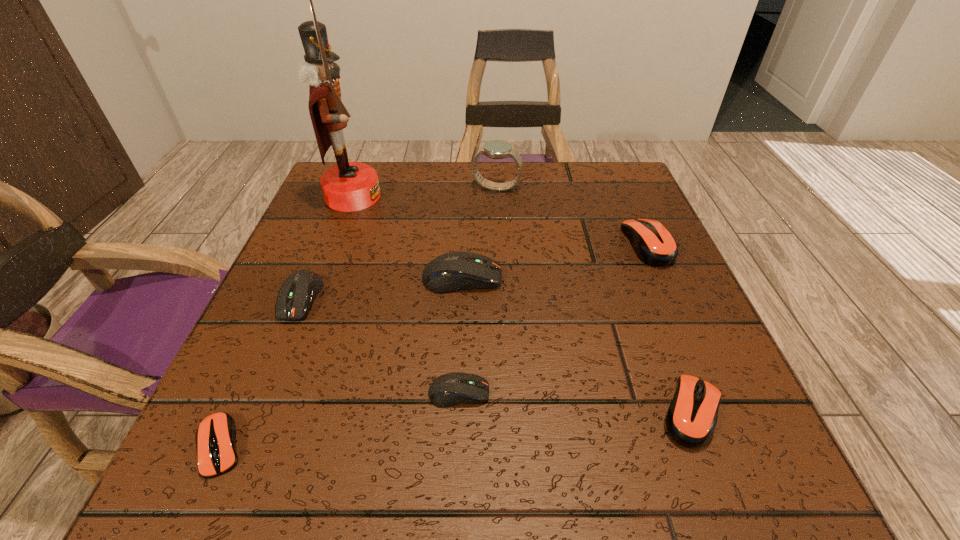
I want to click on red nutcracker, so click(347, 186).

Locate an element on the screen. nutcracker is located at coordinates (347, 186).

You are a GUI agent. You are given a task and a screenshot of the screen. Output one action in this format:
    pyautogui.click(x=<x>, y=<y>)
    Task: Click on the watch
    
    Given the screenshot: What is the action you would take?
    click(x=496, y=149)

The image size is (960, 540). Find the location of `the second tallest object`. the second tallest object is located at coordinates (496, 149).

The height and width of the screenshot is (540, 960). What are the coordinates of `the tallest computer mouse` in the screenshot? It's located at (454, 271).

Where is `the biggest dark computer equipment`? The width and height of the screenshot is (960, 540). the biggest dark computer equipment is located at coordinates (454, 271).

What are the coordinates of `the farthest orange computer mouse` in the screenshot? It's located at (652, 242).

This screenshot has height=540, width=960. Identify the location of the leftmost dark computer equipment. (298, 291).

Find the location of a particular element. the second smallest orange computer mouse is located at coordinates (691, 418).

Locate an element on the screen. the smallest dark computer equipment is located at coordinates (451, 389).